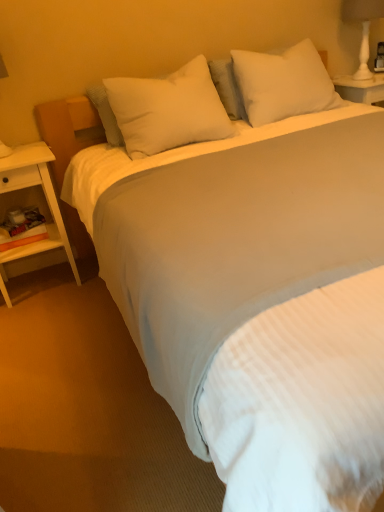
Question: Is the depth of white soft pillow at upper center, the second pillow in the right-to-left sequence, greater than that of white soft pillow at upper center, acting as the first pillow starting from the right?

Choices:
 (A) no
 (B) yes

Answer: (A)

Question: Considering the relative sizes of white soft pillow at upper center, the second pillow in the right-to-left sequence, and white soft pillow at upper center, acting as the first pillow starting from the right, in the image provided, is white soft pillow at upper center, the second pillow in the right-to-left sequence, shorter than white soft pillow at upper center, acting as the first pillow starting from the right,?

Choices:
 (A) no
 (B) yes

Answer: (B)

Question: Is white soft pillow at upper center, the second pillow in the right-to-left sequence, bigger than white soft pillow at upper center, which ranks as the 2th pillow in left-to-right order?

Choices:
 (A) no
 (B) yes

Answer: (A)

Question: From the image's perspective, would you say white soft pillow at upper center, which is the 1th pillow in left-to-right order, is shown under white soft pillow at upper center, acting as the first pillow starting from the right?

Choices:
 (A) no
 (B) yes

Answer: (B)

Question: Is white soft pillow at upper center, which is the 1th pillow in left-to-right order, closer to the viewer compared to white soft pillow at upper center, which ranks as the 2th pillow in left-to-right order?

Choices:
 (A) yes
 (B) no

Answer: (A)

Question: Is white soft pillow at upper center, which is the 1th pillow in left-to-right order, facing away from white soft pillow at upper center, which ranks as the 2th pillow in left-to-right order?

Choices:
 (A) no
 (B) yes

Answer: (A)

Question: Would you say white soft pillow at upper center, which ranks as the 2th pillow in left-to-right order, is outside white soft pillow at upper center, which is the 1th pillow in left-to-right order?

Choices:
 (A) no
 (B) yes

Answer: (B)

Question: Would you say white soft pillow at upper center, which ranks as the 2th pillow in left-to-right order, is a long distance from white soft pillow at upper center, the second pillow in the right-to-left sequence?

Choices:
 (A) no
 (B) yes

Answer: (A)

Question: Is white soft pillow at upper center, which ranks as the 2th pillow in left-to-right order, in contact with white soft pillow at upper center, which is the 1th pillow in left-to-right order?

Choices:
 (A) no
 (B) yes

Answer: (A)

Question: Does white soft pillow at upper center, which ranks as the 2th pillow in left-to-right order, have a greater width compared to white soft pillow at upper center, which is the 1th pillow in left-to-right order?

Choices:
 (A) no
 (B) yes

Answer: (A)

Question: Can you confirm if white soft pillow at upper center, acting as the first pillow starting from the right, is bigger than white soft pillow at upper center, which is the 1th pillow in left-to-right order?

Choices:
 (A) no
 (B) yes

Answer: (B)

Question: Does white soft pillow at upper center, which ranks as the 2th pillow in left-to-right order, have a smaller size compared to white soft pillow at upper center, which is the 1th pillow in left-to-right order?

Choices:
 (A) yes
 (B) no

Answer: (B)

Question: From a real-world perspective, is white wood nightstand at left positioned over white soft pillow at upper center, which is the 1th pillow in left-to-right order, based on gravity?

Choices:
 (A) yes
 (B) no

Answer: (B)